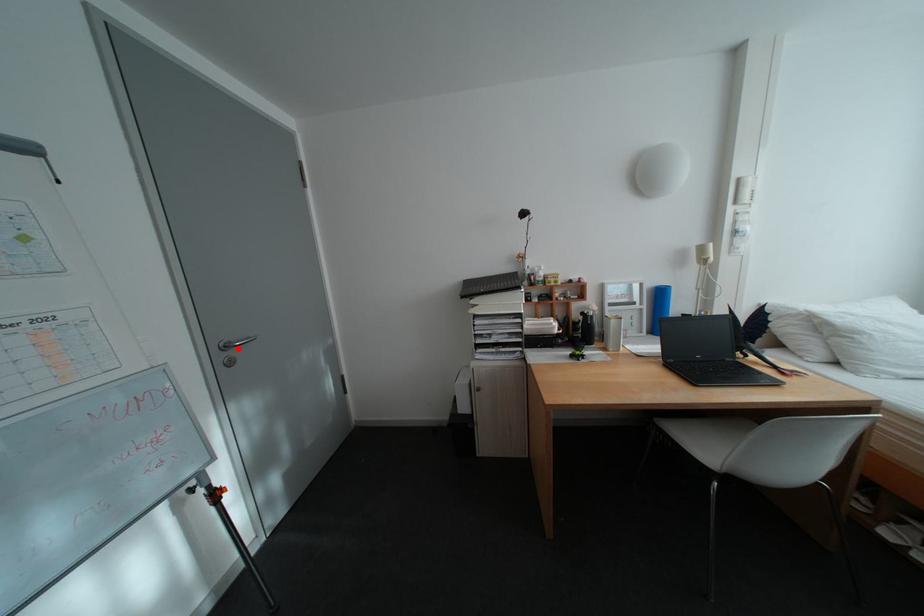
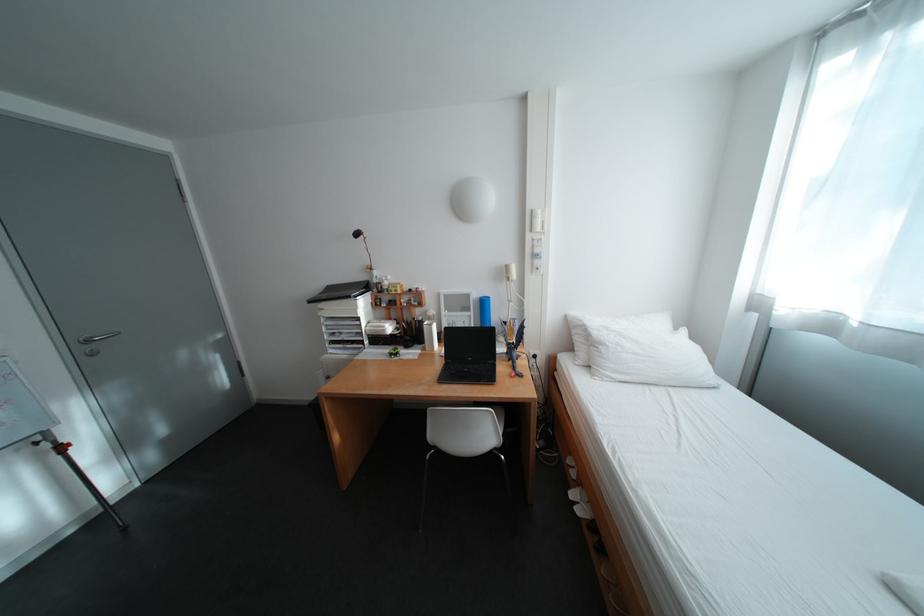
Locate, in the second image, the point that corresponds to the highlighted location in the first image.

(100, 342)